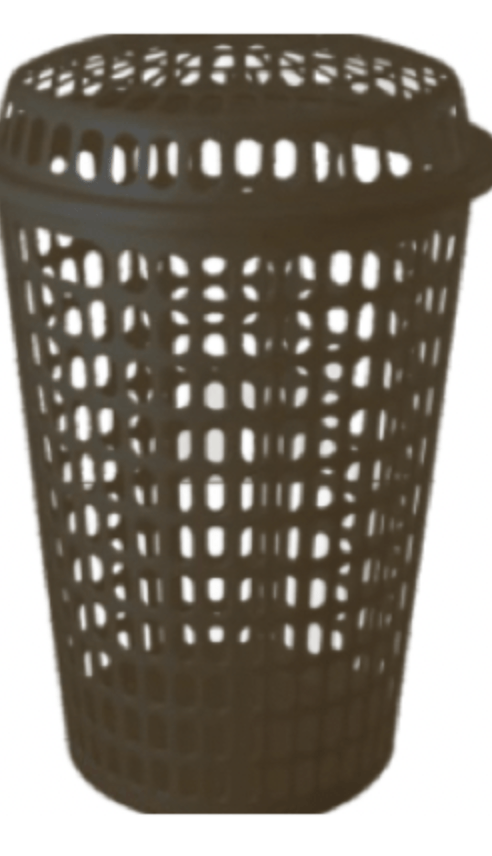
Where is `black basket for basket with holes`? black basket for basket with holes is located at coordinates (220, 627).